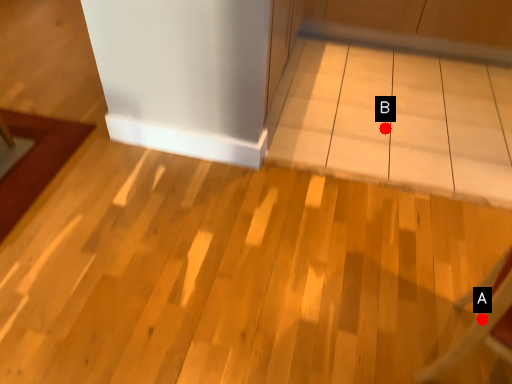
Question: Two points are circled on the image, labeled by A and B beside each circle. Among these points, which one is nearest to the camera?

Choices:
 (A) A is closer
 (B) B is closer

Answer: (A)